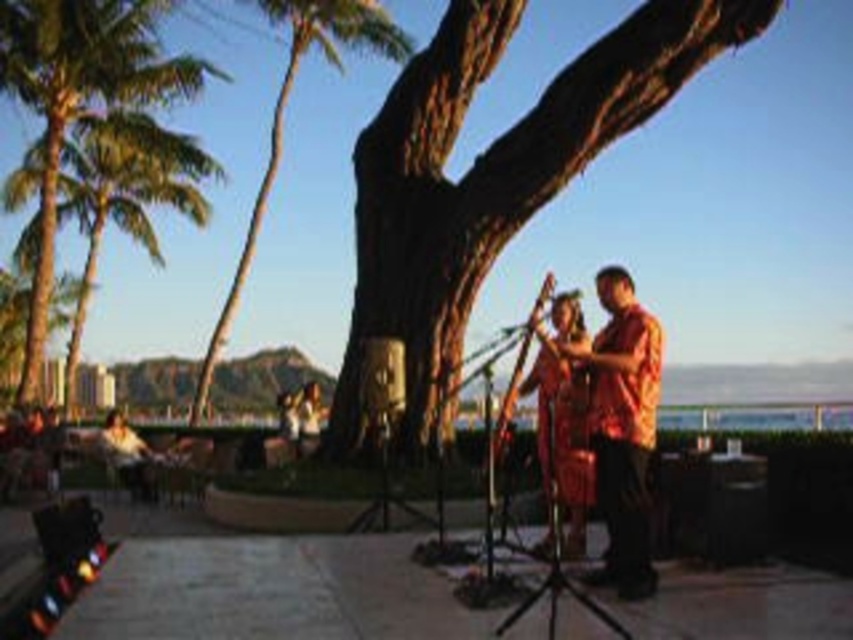
Question: Which of the following is the closest to the observer?

Choices:
 (A) matte black jacket at lower left
 (B) shiny red dress at center
 (C) matte orange shirt at center
 (D) brown rough bark tree at center

Answer: (B)

Question: Can you confirm if brown rough bark tree at center is bigger than green leafy palm tree at left?

Choices:
 (A) yes
 (B) no

Answer: (B)

Question: Is green leafy palm tree at left in front of shiny red dress at center?

Choices:
 (A) yes
 (B) no

Answer: (B)

Question: Which of the following is the farthest from the observer?

Choices:
 (A) (558, 396)
 (B) (283, 1)

Answer: (B)

Question: Does brown rough bark tree at center have a lesser width compared to green leafy palm tree at upper left?

Choices:
 (A) yes
 (B) no

Answer: (A)

Question: Which of the following is the farthest from the observer?

Choices:
 (A) green leafy palm tree at upper left
 (B) shiny red dress at center

Answer: (A)